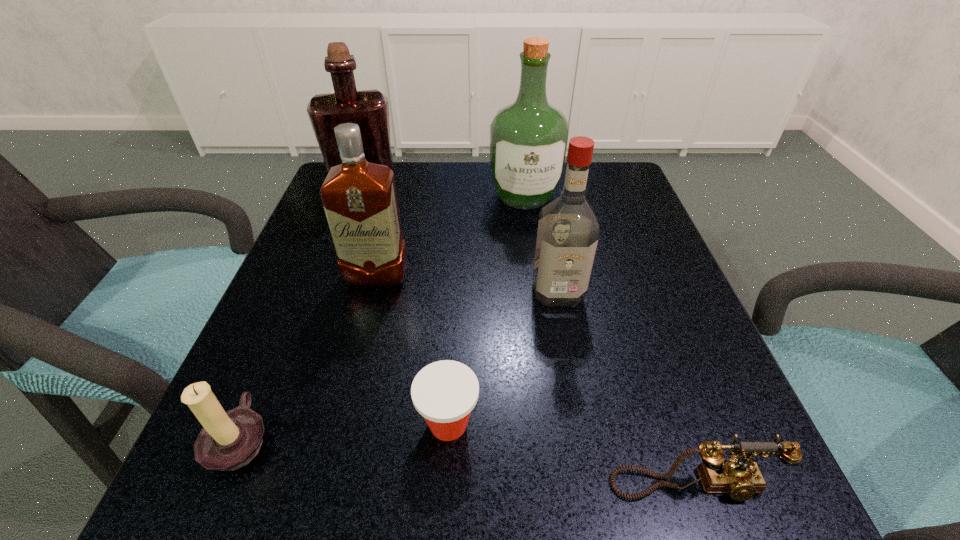
You are a GUI agent. You are given a task and a screenshot of the screen. Output one action in this format:
    pyautogui.click(x=<x>, y=<y>)
    Task: Click on the free point between the third shortest object and the telephone
    
    Given the screenshot: What is the action you would take?
    pyautogui.click(x=467, y=462)

Where is `blank region between the candle holder and the fourth object from right to left`? This screenshot has width=960, height=540. blank region between the candle holder and the fourth object from right to left is located at coordinates (345, 431).

At what (x,y) coordinates should I click in order to perform the action: click on the sixth closest object to the fourth object from right to left. Please return your answer as a coordinate pair (x, y). Looking at the image, I should click on (369, 109).

Locate which object is the fifth closest to the telephone. Please provide its 2D coordinates. Your answer should be formatted as a tuple, i.e. [(x, y)], where the tuple contains the x and y coordinates of a point satisfying the conditions above.

[(529, 138)]

Locate which liquor is the fourth closest to the Dixie cup. Please provide its 2D coordinates. Your answer should be formatted as a tuple, i.e. [(x, y)], where the tuple contains the x and y coordinates of a point satisfying the conditions above.

[(369, 109)]

The width and height of the screenshot is (960, 540). I want to click on the third closest liquor to the Dixie cup, so click(529, 138).